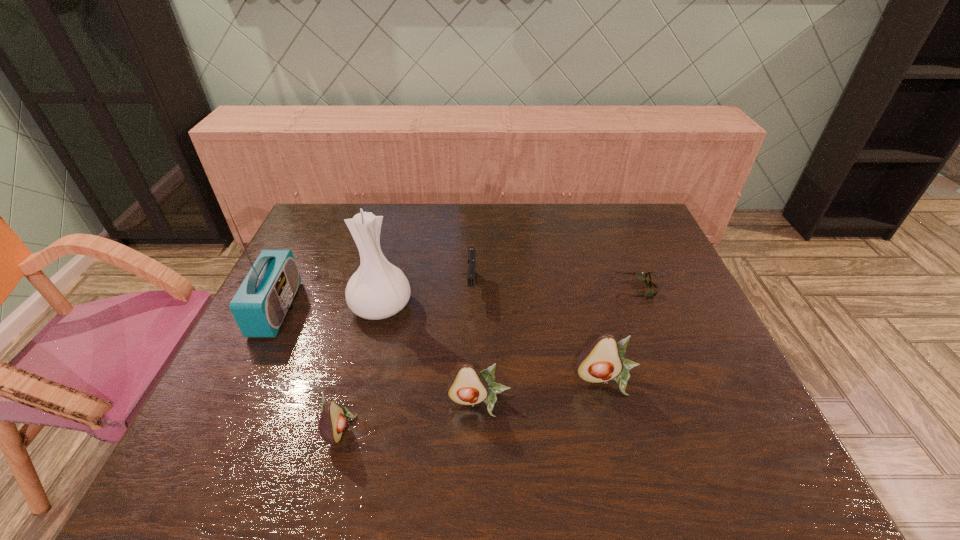
Identify the location of vacant point located between the leftmost avocado and the vase. (361, 367).

I want to click on vacant area that lies between the rightmost avocado and the shortest object, so click(x=622, y=335).

At what (x,y) coordinates should I click in order to perform the action: click on vacant space that's between the second tallest object and the leftmost object. Please return your answer as a coordinate pair (x, y). This screenshot has height=540, width=960. Looking at the image, I should click on pyautogui.click(x=328, y=308).

At what (x,y) coordinates should I click in order to perform the action: click on empty location between the sixth shortest object and the radio receiver. Please return your answer as a coordinate pair (x, y). Looking at the image, I should click on (328, 308).

Locate which object ranks sixth in proximity to the shortest object. Please provide its 2D coordinates. Your answer should be formatted as a tuple, i.e. [(x, y)], where the tuple contains the x and y coordinates of a point satisfying the conditions above.

[(261, 303)]

Find the location of a particular element. object that is the sixth nearest to the sixth object from left to right is located at coordinates (261, 303).

At what (x,y) coordinates should I click in order to perform the action: click on avocado that stands as the second closest to the second avocado from right to left. Please return your answer as a coordinate pair (x, y). This screenshot has width=960, height=540. Looking at the image, I should click on (333, 420).

Select which avocado appears as the second closest to the leftmost avocado. Please provide its 2D coordinates. Your answer should be formatted as a tuple, i.e. [(x, y)], where the tuple contains the x and y coordinates of a point satisfying the conditions above.

[(601, 361)]

At what (x,y) coordinates should I click in order to perform the action: click on vacant space that satisfies the following two spatial constraints: 1. on the seed side of the second avocado from left to right; 2. on the seed side of the leftmost avocado. Please return your answer as a coordinate pair (x, y). The width and height of the screenshot is (960, 540). Looking at the image, I should click on (480, 427).

Find the location of a particular element. Image resolution: width=960 pixels, height=540 pixels. blank area in the image that satisfies the following two spatial constraints: 1. on the front-facing side of the shortest object; 2. on the seed side of the rightmost avocado is located at coordinates (675, 381).